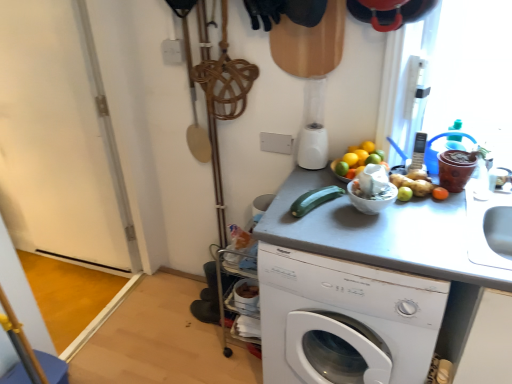
Locate an element on the screen. free location to the right of white glossy bowl at upper right is located at coordinates (423, 218).